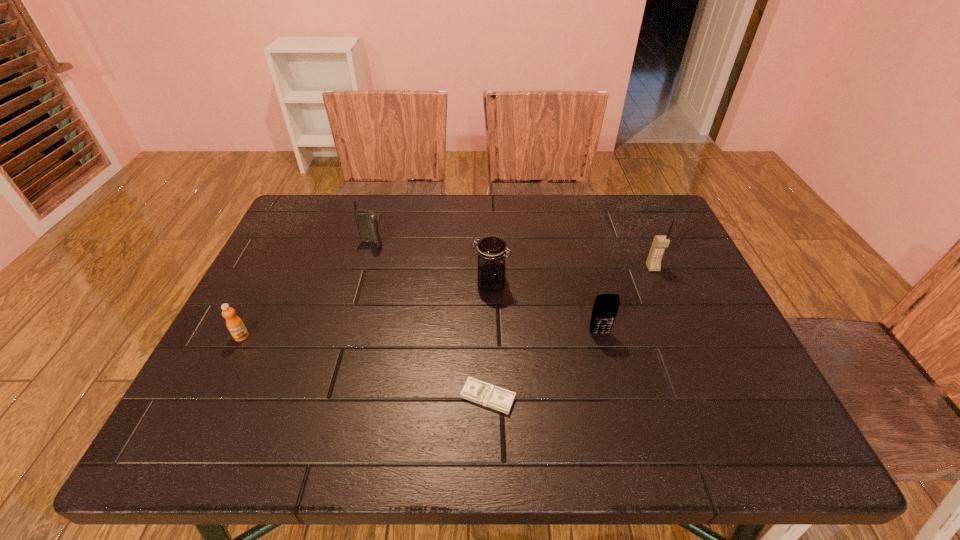
Where is `the rightmost object`? the rightmost object is located at coordinates (660, 242).

Image resolution: width=960 pixels, height=540 pixels. In order to click on the second farthest cellular telephone in this screenshot , I will do `click(660, 242)`.

Where is `the farthest object`? The width and height of the screenshot is (960, 540). the farthest object is located at coordinates coord(366,220).

At what (x,y) coordinates should I click in order to perform the action: click on the leftmost cellular telephone. Please return your answer as a coordinate pair (x, y). Looking at the image, I should click on (366, 220).

Where is `jar`? The image size is (960, 540). jar is located at coordinates (491, 266).

Find the location of a particular element. The width and height of the screenshot is (960, 540). the fifth object from left to right is located at coordinates (605, 309).

Image resolution: width=960 pixels, height=540 pixels. Identify the location of the second cellular telephone from left to right. (605, 309).

Identify the location of the leftmost object. This screenshot has height=540, width=960. (235, 325).

The height and width of the screenshot is (540, 960). Find the location of `the fifth tallest object`. the fifth tallest object is located at coordinates (235, 325).

Where is `the shortest object`? This screenshot has height=540, width=960. the shortest object is located at coordinates (474, 390).